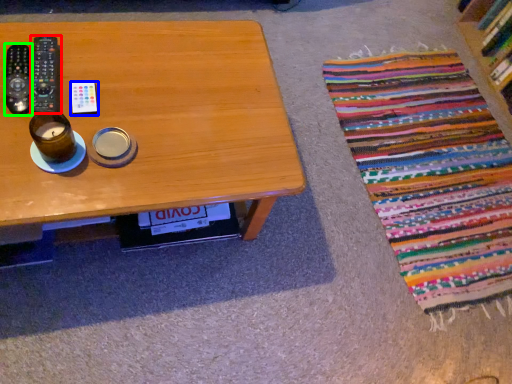
Question: Estimate the real-world distances between objects in this image. Which object is farther from remote control (highlighted by a red box), remote control (highlighted by a blue box) or remote control (highlighted by a green box)?

Choices:
 (A) remote control
 (B) remote control

Answer: (A)